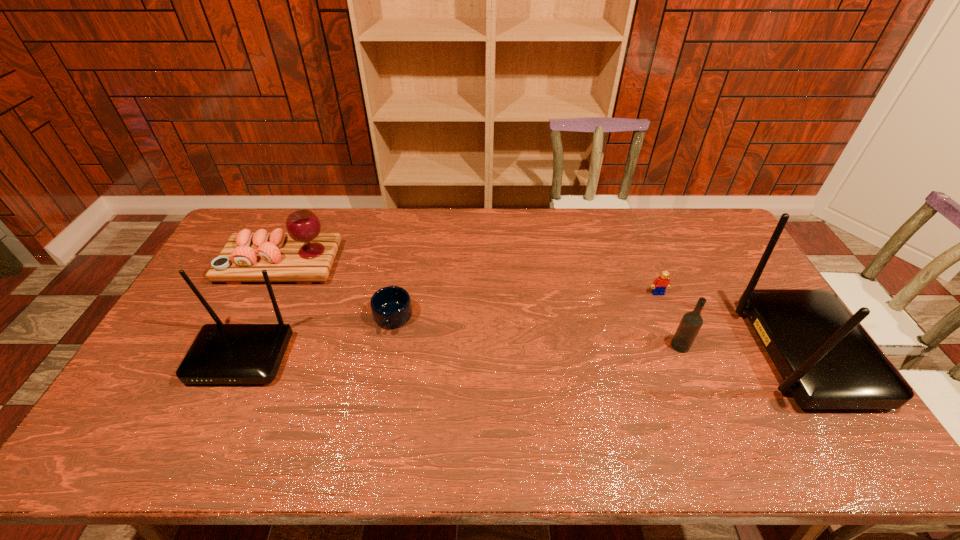
Find the location of a particular element. The height and width of the screenshot is (540, 960). free space between the shortest object and the second tallest object is located at coordinates (318, 337).

The width and height of the screenshot is (960, 540). I want to click on vacant space in between the shortest object and the taller router, so [599, 335].

Locate an element on the screen. The image size is (960, 540). vacant space in between the Lego and the farthest object is located at coordinates (469, 278).

Identify the location of vacant point located between the vodka and the Lego. This screenshot has height=540, width=960. (669, 320).

The image size is (960, 540). I want to click on vacant area that lies between the fourth object from right to left and the second tallest object, so [318, 337].

Where is `vacant space that's between the second tallest object and the right router`? vacant space that's between the second tallest object and the right router is located at coordinates (523, 355).

Where is `empty location between the rightmost object and the vodka`? The width and height of the screenshot is (960, 540). empty location between the rightmost object and the vodka is located at coordinates [742, 349].

This screenshot has width=960, height=540. I want to click on the fifth closest object to the Lego, so click(x=221, y=353).

Point out which object is positioned as the third nearest to the vodka. Please provide its 2D coordinates. Your answer should be formatted as a tuple, i.e. [(x, y)], where the tuple contains the x and y coordinates of a point satisfying the conditions above.

[(391, 307)]

Locate an element on the screen. free space in the image that satisfies the following two spatial constraints: 1. on the front-facing side of the vodka; 2. on the right side of the fifth tallest object is located at coordinates (679, 346).